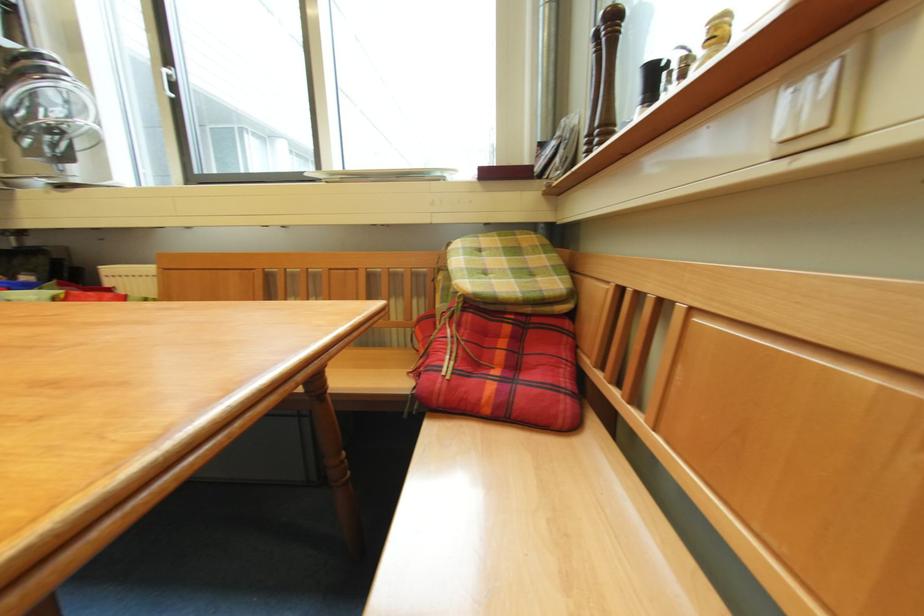
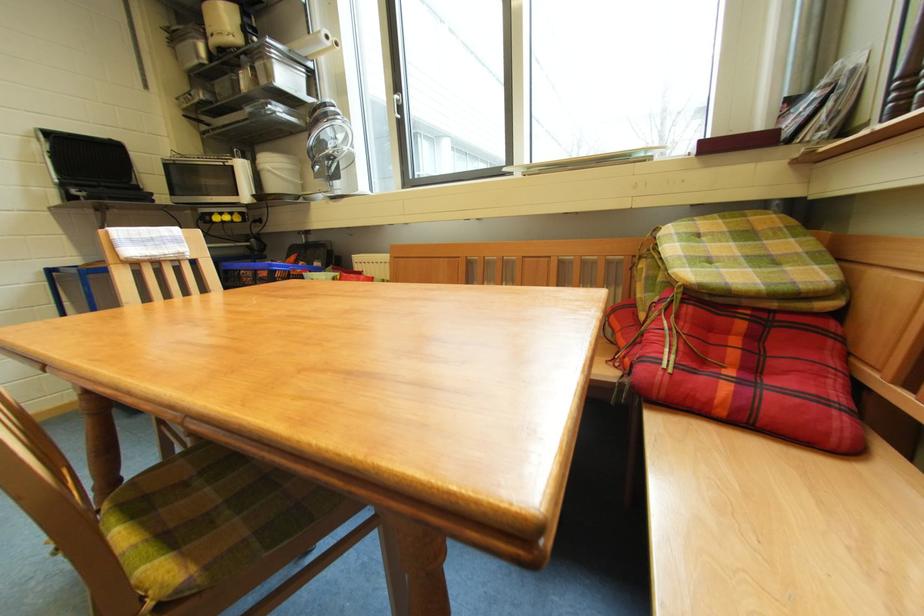
Locate, in the second image, the point that corresponds to (477,317) in the first image.

(698, 310)